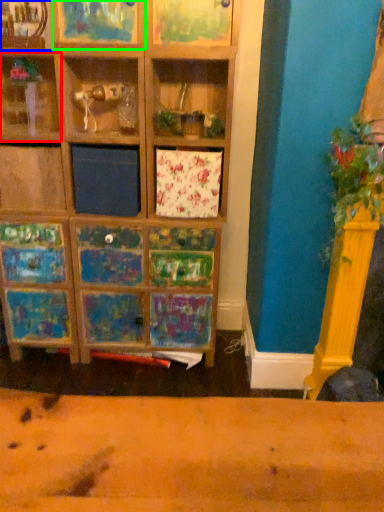
Question: Which object is the farthest from shelf (highlighted by a red box)? Choose among these: shelf (highlighted by a blue box) or shelf (highlighted by a green box).

Choices:
 (A) shelf
 (B) shelf

Answer: (B)